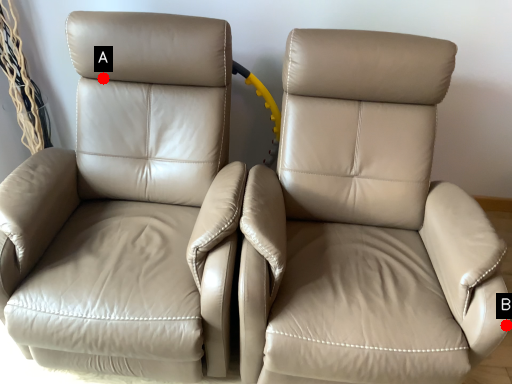
Question: Two points are circled on the image, labeled by A and B beside each circle. Among these points, which one is farthest from the camera?

Choices:
 (A) A is further
 (B) B is further

Answer: (A)